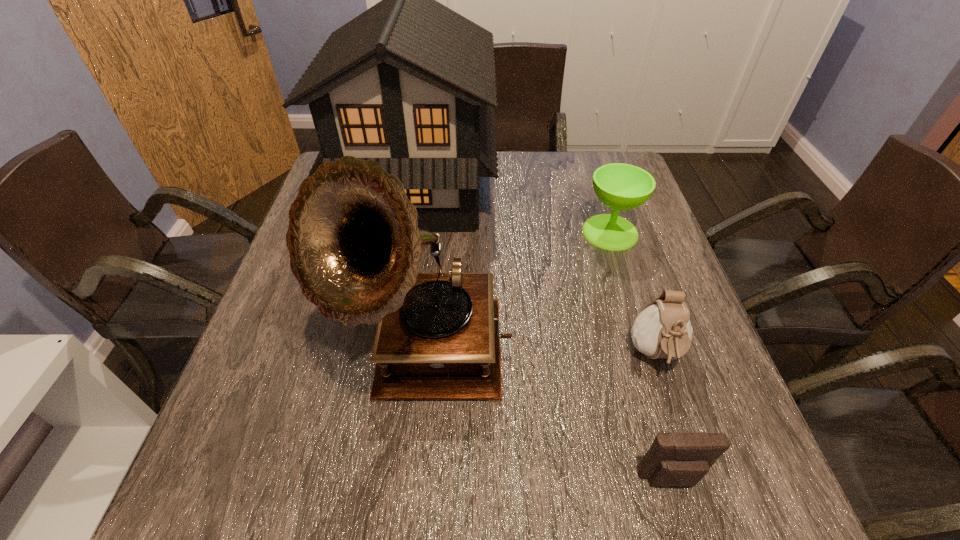
Where is `vacant area that lies between the dollhouse and the wineglass`? This screenshot has height=540, width=960. vacant area that lies between the dollhouse and the wineglass is located at coordinates (514, 212).

Find the location of a particular element. The image size is (960, 540). free point between the farther pouch and the shortest object is located at coordinates (663, 416).

Image resolution: width=960 pixels, height=540 pixels. In order to click on free space between the shorter pouch and the dollhouse in this screenshot , I will do `click(544, 335)`.

Where is `free spot between the farther pouch and the record player`? Image resolution: width=960 pixels, height=540 pixels. free spot between the farther pouch and the record player is located at coordinates (540, 356).

This screenshot has height=540, width=960. What are the coordinates of `vacant space that is in between the shorter pouch and the wineglass` in the screenshot? It's located at (640, 355).

Image resolution: width=960 pixels, height=540 pixels. What are the coordinates of `vacant area that lies between the nearest object and the record player` in the screenshot? It's located at point(548,417).

The height and width of the screenshot is (540, 960). Identify the location of unoccupied area between the nearest object and the wineglass. (640, 355).

Where is `vacant area that lies between the nearer pouch and the farther pouch`? The height and width of the screenshot is (540, 960). vacant area that lies between the nearer pouch and the farther pouch is located at coordinates (x=663, y=416).

The width and height of the screenshot is (960, 540). What are the coordinates of `vacant space in between the taller pouch and the nearest object` in the screenshot? It's located at (663, 416).

Identify the location of vacant space that's between the shortest object and the wineglass. (640, 355).